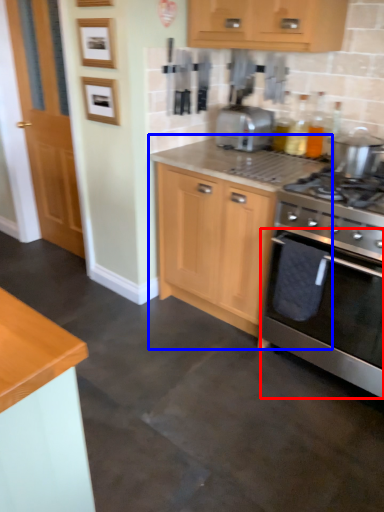
Question: Which point is closer to the camera, oven (highlighted by a red box) or cabinetry (highlighted by a blue box)?

Choices:
 (A) oven
 (B) cabinetry

Answer: (A)